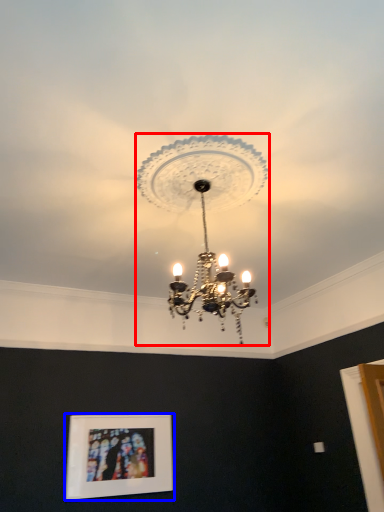
Question: Which of the following is the closest to the observer, lamp (highlighted by a red box) or picture frame (highlighted by a blue box)?

Choices:
 (A) lamp
 (B) picture frame

Answer: (A)